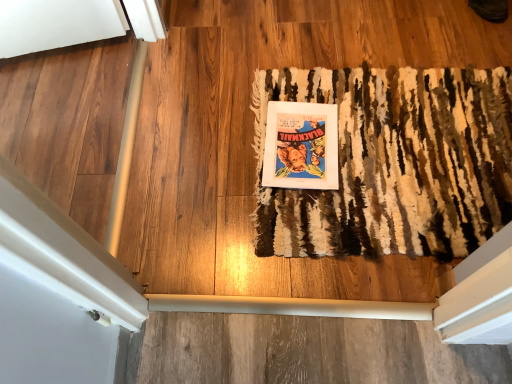
Describe the element at coordinates (301, 146) in the screenshot. I see `matte paper poster at center` at that location.

Measure the distance between matte paper poster at center and camera.

The distance of matte paper poster at center from camera is 3.82 feet.

Locate an element on the screen. This screenshot has width=512, height=384. matte paper poster at center is located at coordinates (301, 146).

Measure the distance between point (326, 83) and camera.

A distance of 4.39 feet exists between point (326, 83) and camera.

Image resolution: width=512 pixels, height=384 pixels. What do you see at coordinates (394, 163) in the screenshot?
I see `rug at center` at bounding box center [394, 163].

The width and height of the screenshot is (512, 384). I want to click on rug at center, so click(x=394, y=163).

Identify the location of matte paper poster at center. (301, 146).

Is matte paper poster at center to the left or to the right of rug at center in the image?

matte paper poster at center is positioned on rug at center's left side.

Is matte paper poster at center closer to camera compared to rug at center?

No, matte paper poster at center is further to the viewer.

Does point (264, 175) come closer to viewer compared to point (426, 122)?

Yes, point (264, 175) is in front of point (426, 122).

From the image's perspective, between matte paper poster at center and rug at center, which one is located above?

From the image's view, matte paper poster at center is above.

From a real-world perspective, is matte paper poster at center positioned above or below rug at center?

Clearly, from a real-world perspective, matte paper poster at center is below rug at center.

Which object is thinner, matte paper poster at center or rug at center?

matte paper poster at center is thinner.

Can you confirm if matte paper poster at center is shorter than rug at center?

In fact, matte paper poster at center may be taller than rug at center.

Which of these two, matte paper poster at center or rug at center, is bigger?

rug at center is bigger.

Is matte paper poster at center spatially inside rug at center, or outside of it?

matte paper poster at center can be found inside rug at center.

In the scene shown: Is the surface of matte paper poster at center in direct contact with rug at center?

No.

Is matte paper poster at center facing towards rug at center?

Yes.

Can you tell me how much matte paper poster at center and rug at center differ in facing direction?

The angular difference between matte paper poster at center and rug at center is 4.78 degrees.

Image resolution: width=512 pixels, height=384 pixels. Identify the location of mat below the matte paper poster at center (from the image's perspective). (394, 163).

Considering the positions of objects rug at center and matte paper poster at center in the image provided, who is more to the right, rug at center or matte paper poster at center?

From the viewer's perspective, rug at center appears more on the right side.

Who is more distant, rug at center or matte paper poster at center?

matte paper poster at center is further from the camera.

Does point (369, 67) come in front of point (312, 156)?

No, it is behind (312, 156).

From the image's perspective, is rug at center on top of matte paper poster at center?

No.

From a real-world perspective, which is physically above, rug at center or matte paper poster at center?

rug at center, from a real-world perspective.

In the scene shown: Considering the relative sizes of rug at center and matte paper poster at center in the image provided, is rug at center wider than matte paper poster at center?

Yes, rug at center is wider than matte paper poster at center.

Does rug at center have a lesser height compared to matte paper poster at center?

Yes.

Can you confirm if rug at center is bigger than matte paper poster at center?

Indeed, rug at center has a larger size compared to matte paper poster at center.

Is matte paper poster at center a part of rug at center?

Yes, matte paper poster at center is a part of rug at center.

Is rug at center positioned far away from matte paper poster at center?

Answer: rug at center is actually quite close to matte paper poster at center.

Does rug at center turn towards matte paper poster at center?

No, rug at center is not aimed at matte paper poster at center.

Can you tell me how much rug at center and matte paper poster at center differ in facing direction?

The facing directions of rug at center and matte paper poster at center are 4.78 degrees apart.

You are a GUI agent. You are given a task and a screenshot of the screen. Output one action in this format:
    pyautogui.click(x=<x>, y=<y>)
    Task: Click on the mat that is above the matte paper poster at center (from a real-world perspective)
    The width and height of the screenshot is (512, 384).
    Given the screenshot: What is the action you would take?
    pyautogui.click(x=394, y=163)

In the image, there is a matte paper poster at center. At what (x,y) coordinates should I click in order to perform the action: click on mat below it (from the image's perspective). Please return your answer as a coordinate pair (x, y). This screenshot has width=512, height=384. Looking at the image, I should click on click(x=394, y=163).

Locate an element on the screen. This screenshot has height=384, width=512. paperback book behind the rug at center is located at coordinates (301, 146).